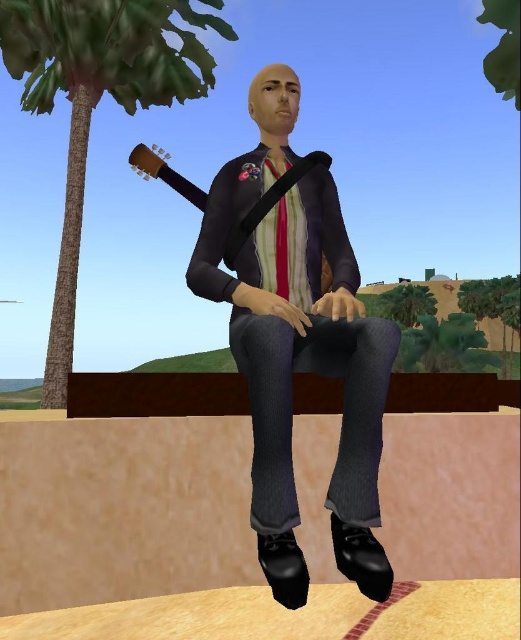
Who is more distant from viewer, (77,200) or (293,172)?

The point (77,200) is more distant.

Can you confirm if green leafy palm tree at upper left is bigger than wooden acoustic guitar at center?

Indeed, green leafy palm tree at upper left has a larger size compared to wooden acoustic guitar at center.

The width and height of the screenshot is (521, 640). I want to click on green leafy palm tree at upper left, so click(98, 100).

In order to click on green leafy palm tree at upper left in this screenshot , I will do `click(98, 100)`.

How far apart are green leafy tree at center and red satin tie at center?

A distance of 17.99 meters exists between green leafy tree at center and red satin tie at center.

Looking at this image, is green leafy tree at center bigger than red satin tie at center?

Yes.

Image resolution: width=521 pixels, height=640 pixels. What do you see at coordinates (405, 304) in the screenshot?
I see `green leafy tree at center` at bounding box center [405, 304].

Identify the location of green leafy tree at center. This screenshot has width=521, height=640. (405, 304).

Is matte black jacket at center wider than wooden acoustic guitar at center?

Correct, the width of matte black jacket at center exceeds that of wooden acoustic guitar at center.

Can you confirm if matte black jacket at center is positioned to the right of wooden acoustic guitar at center?

Indeed, matte black jacket at center is positioned on the right side of wooden acoustic guitar at center.

Where is `matte black jacket at center`? matte black jacket at center is located at coordinates (299, 346).

You are a GUI agent. You are given a task and a screenshot of the screen. Output one action in this format:
    pyautogui.click(x=<x>, y=<y>)
    Task: Click on the matte black jacket at center
    The width and height of the screenshot is (521, 640).
    Given the screenshot: What is the action you would take?
    pyautogui.click(x=299, y=346)